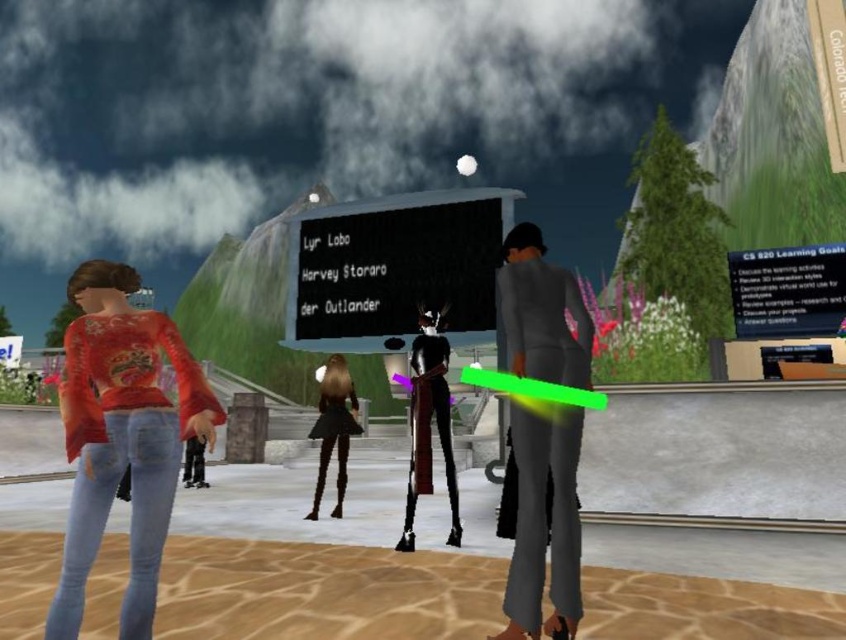
Does shiny black dress at center have a lesser height compared to black matte dress at center?

Correct, shiny black dress at center is not as tall as black matte dress at center.

Between point (419, 416) and point (334, 385), which one is positioned in front?

Point (419, 416)

This screenshot has height=640, width=846. In order to click on shiny black dress at center in this screenshot , I will do `click(427, 420)`.

Does distressed denim jeans at left have a greater width compared to shiny black dress at center?

Indeed, distressed denim jeans at left has a greater width compared to shiny black dress at center.

Is distressed denim jeans at left behind shiny black dress at center?

No, it is in front of shiny black dress at center.

At what (x,y) coordinates should I click in order to perform the action: click on distressed denim jeans at left. Please return your answer as a coordinate pair (x, y). Image resolution: width=846 pixels, height=640 pixels. Looking at the image, I should click on (121, 436).

Identify the location of distressed denim jeans at left. (121, 436).

Can you confirm if distressed denim jeans at left is positioned above black matte dress at center?

Indeed, distressed denim jeans at left is positioned over black matte dress at center.

Which is in front, point (132, 470) or point (328, 449)?

Point (132, 470) is in front.

Identify the location of distressed denim jeans at left. (121, 436).